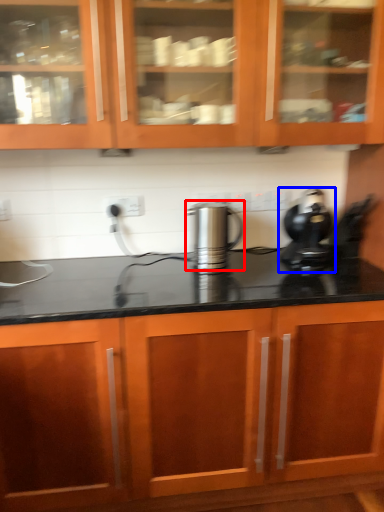
Question: Which object appears farthest to the camera in this image, kitchen appliance (highlighted by a red box) or home appliance (highlighted by a blue box)?

Choices:
 (A) kitchen appliance
 (B) home appliance

Answer: (A)